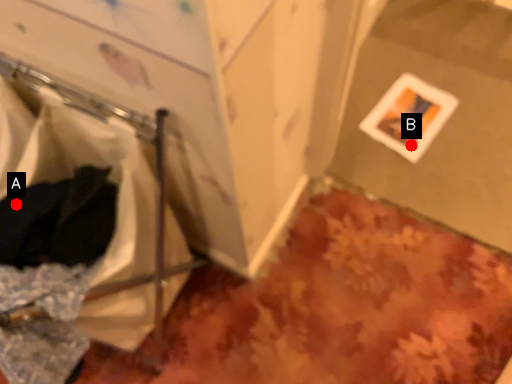
Question: Two points are circled on the image, labeled by A and B beside each circle. Which point is closer to the camera?

Choices:
 (A) A is closer
 (B) B is closer

Answer: (A)